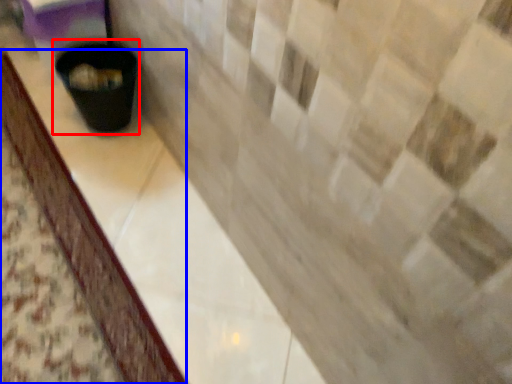
Question: Which of the following is the closest to the observer, waste container (highlighted by a red box) or counter top (highlighted by a blue box)?

Choices:
 (A) waste container
 (B) counter top

Answer: (B)